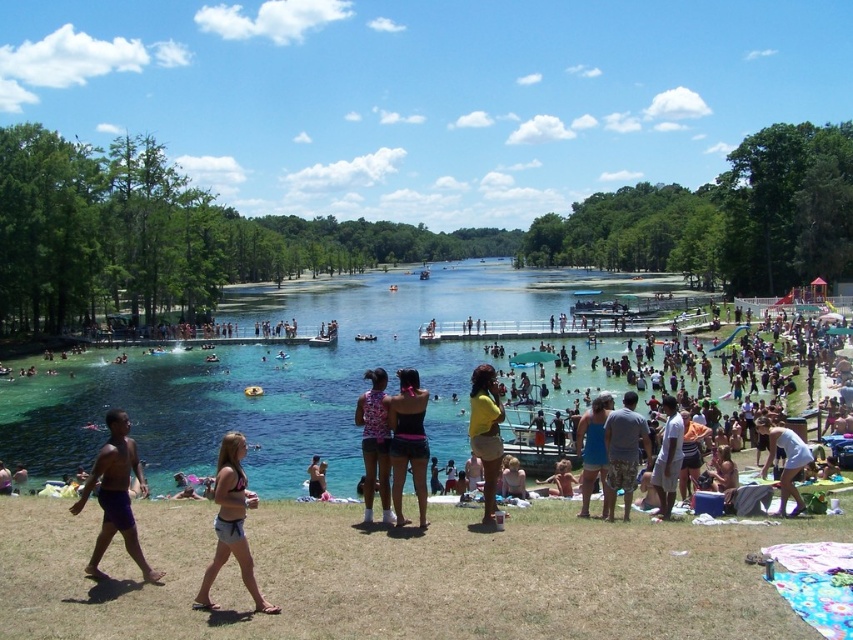
Which is below, yellow matte shorts at center or blue fabric dress at center?

blue fabric dress at center is below.

Is yellow matte shorts at center thinner than blue fabric dress at center?

Yes, yellow matte shorts at center is thinner than blue fabric dress at center.

Is point (483, 472) behind point (587, 433)?

Yes, point (483, 472) is farther from viewer.

At what (x,y) coordinates should I click in order to perform the action: click on yellow matte shorts at center. Please return your answer as a coordinate pair (x, y). The height and width of the screenshot is (640, 853). Looking at the image, I should click on (486, 433).

The image size is (853, 640). What do you see at coordinates (486, 433) in the screenshot?
I see `yellow matte shorts at center` at bounding box center [486, 433].

How much distance is there between yellow matte shorts at center and camouflage shorts at center?

The distance of yellow matte shorts at center from camouflage shorts at center is 6.10 meters.

Between point (482, 404) and point (607, 497), which one is positioned behind?

Positioned behind is point (482, 404).

Find the location of `yellow matte shorts at center`. yellow matte shorts at center is located at coordinates (486, 433).

In the scene shown: Can you confirm if purple shorts at lower left is positioned to the right of beige denim shorts at lower center?

Incorrect, purple shorts at lower left is not on the right side of beige denim shorts at lower center.

Which of these two, purple shorts at lower left or beige denim shorts at lower center, stands shorter?

With less height is beige denim shorts at lower center.

The width and height of the screenshot is (853, 640). Identify the location of purple shorts at lower left. (114, 496).